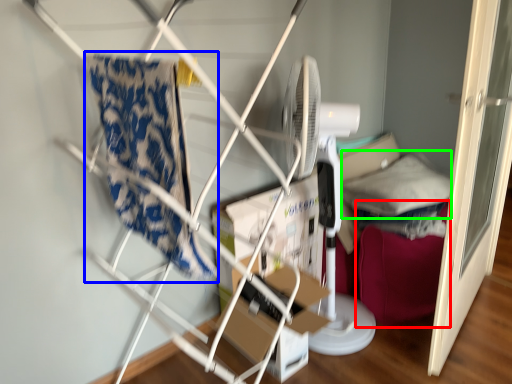
Question: Considering the real-world distances, which object is farthest from bean bag chair (highlighted by a red box)? beach towel (highlighted by a blue box) or pillow (highlighted by a green box)?

Choices:
 (A) beach towel
 (B) pillow

Answer: (A)